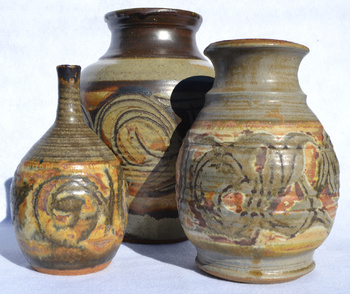
You are a GUI agent. You are given a task and a screenshot of the screen. Output one action in this format:
    pyautogui.click(x=<x>, y=<y>)
    Task: Click on the darker blue floor
    The height and width of the screenshot is (294, 350).
    Given the screenshot: What is the action you would take?
    pyautogui.click(x=128, y=275)